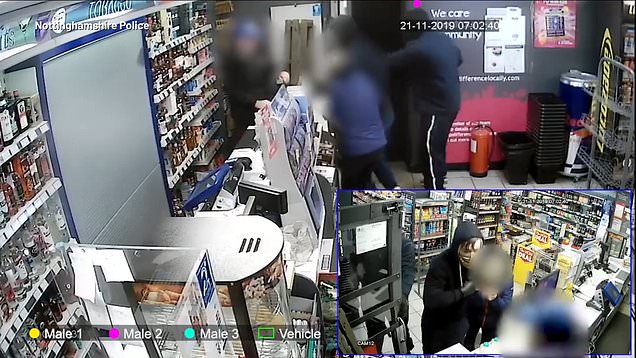
Where is `liquor bottles`? This screenshot has width=636, height=358. liquor bottles is located at coordinates (177, 109).